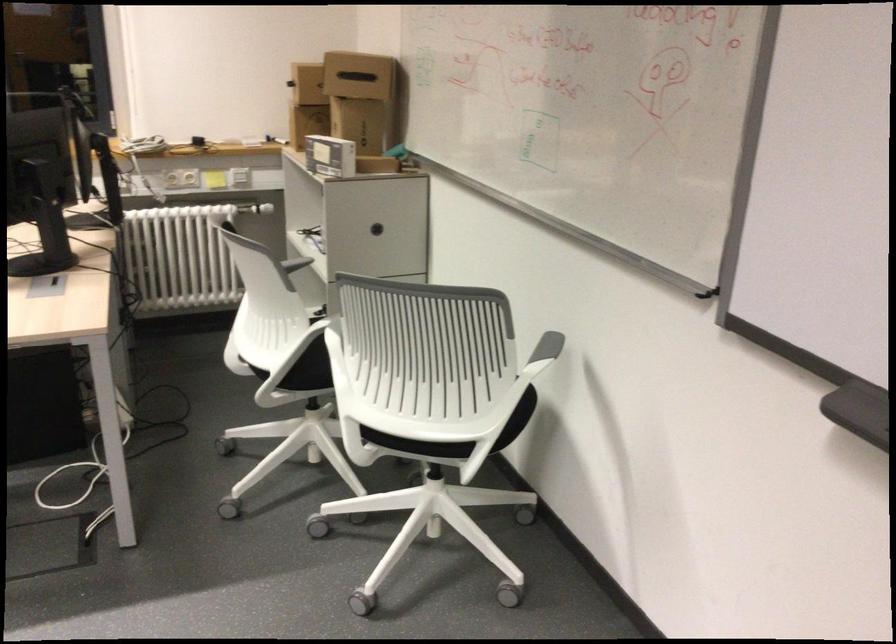
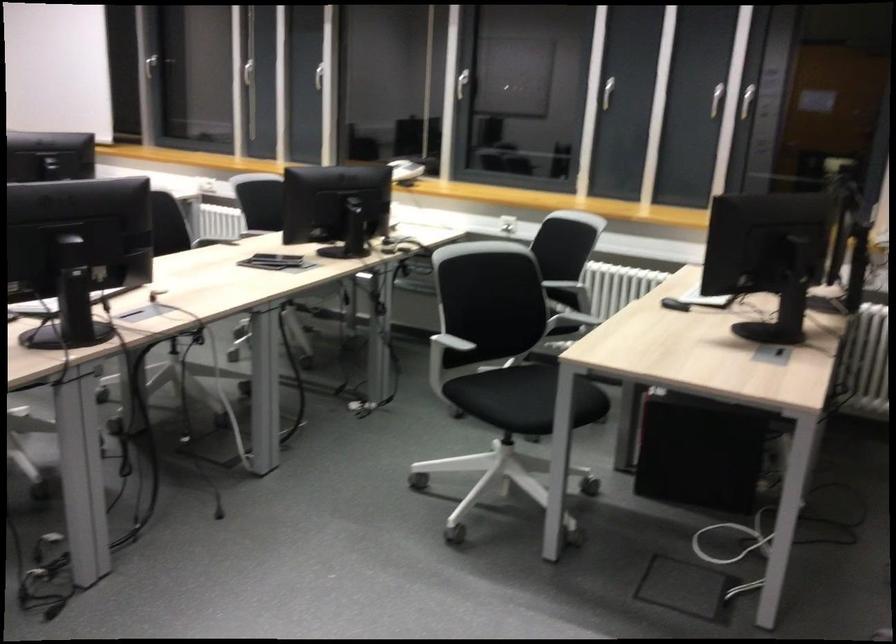
Question: The images are taken continuously from a first-person perspective. In which direction is your viewpoint rotating?

Choices:
 (A) Left
 (B) Right
 (C) Up
 (D) Down

Answer: (A)